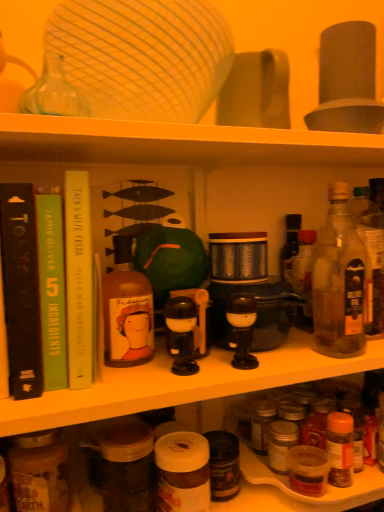
Image resolution: width=384 pixels, height=512 pixels. In order to click on vacant area that lies to the right of black plastic toy at center in this screenshot , I will do `click(277, 355)`.